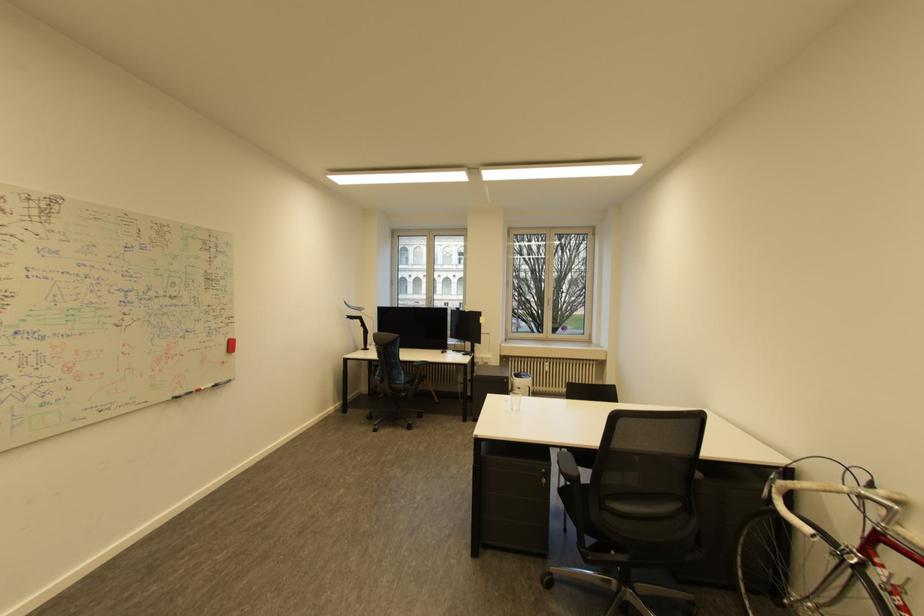
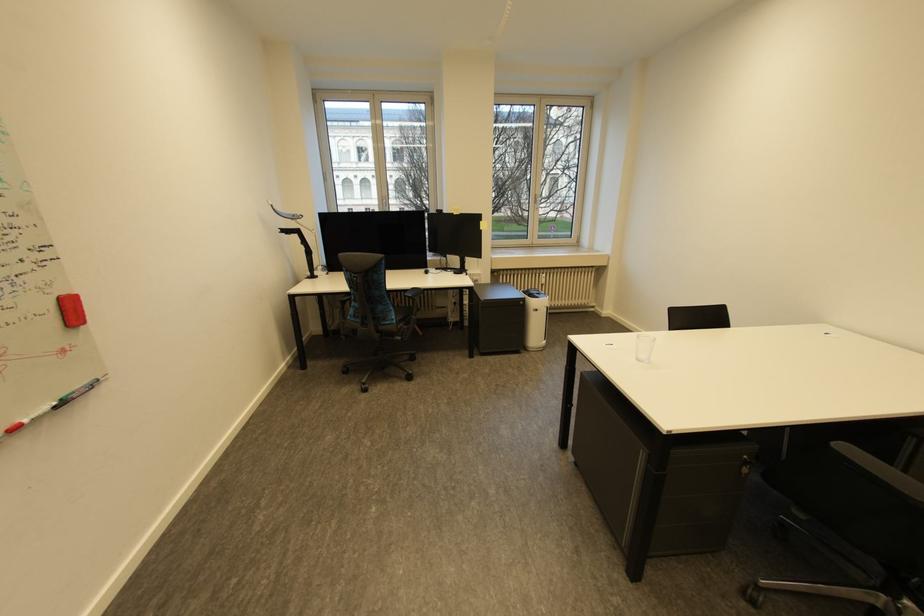
The point at (551, 471) is marked in the first image. Where is the corresponding point in the second image?

(752, 456)